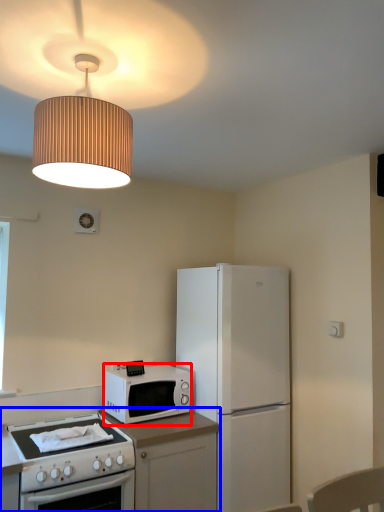
Question: Which object is closer to the camera taking this photo, microwave oven (highlighted by a red box) or countertop (highlighted by a blue box)?

Choices:
 (A) microwave oven
 (B) countertop

Answer: (B)